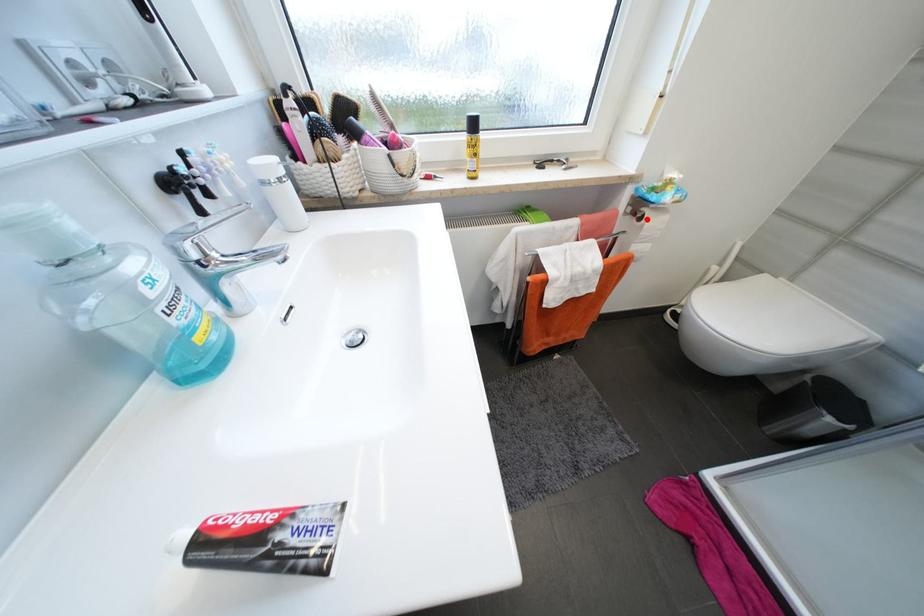
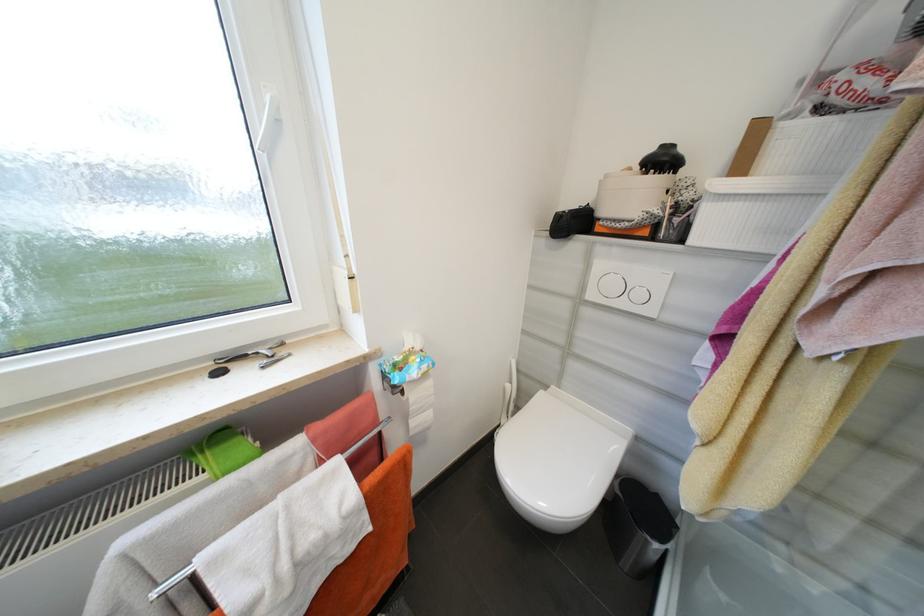
Question: I am providing you with two images of the same scene from different viewpoints. Given a red point in image1, look at the same physical point in image2. Is it:

Choices:
 (A) Closer to the viewpoint
 (B) Farther from the viewpoint

Answer: (B)